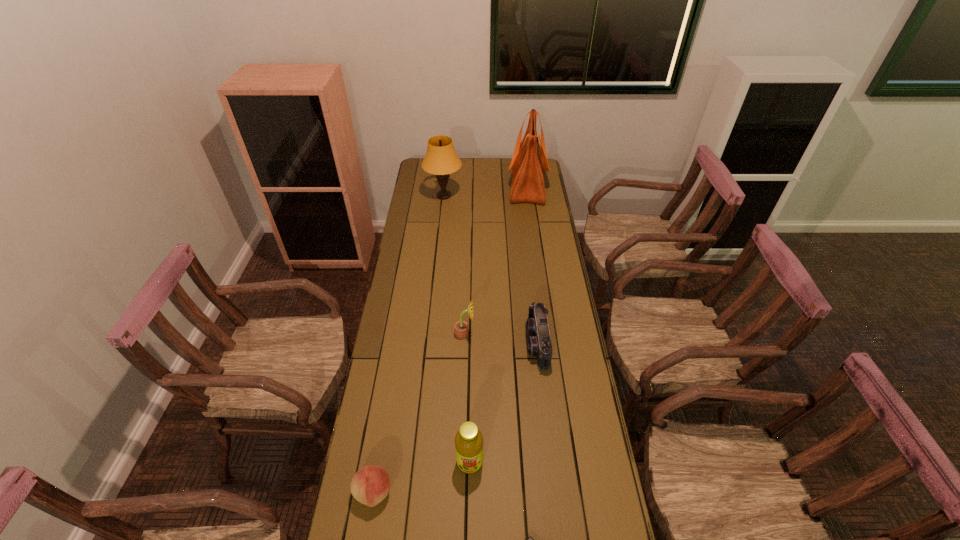
Find the location of a particular element. This screenshot has height=540, width=960. free space at the left edge of the desktop is located at coordinates (427, 284).

The image size is (960, 540). In the image, there is a desktop. Identify the location of free space at the right edge. (547, 274).

The image size is (960, 540). In the image, there is a desktop. In order to click on vacant space at the far left corner in this screenshot , I will do `click(415, 173)`.

Find the location of `free location at the far right corner of the desktop`. free location at the far right corner of the desktop is located at coordinates (545, 172).

What are the coordinates of `vacant area that lies between the shopping bag and the second shortest object` in the screenshot? It's located at (450, 339).

I want to click on vacant space in between the sunflower and the fifth tallest object, so click(501, 339).

Find the location of a particular element. unoccupied area between the shopping bag and the camcorder is located at coordinates (533, 265).

The image size is (960, 540). Find the location of `vacant region between the shopping bag and the camcorder`. vacant region between the shopping bag and the camcorder is located at coordinates (533, 265).

Locate an element on the screen. Image resolution: width=960 pixels, height=540 pixels. free space between the shopping bag and the sixth tallest object is located at coordinates (450, 339).

This screenshot has height=540, width=960. I want to click on free space between the shopping bag and the lampshade, so click(x=486, y=191).